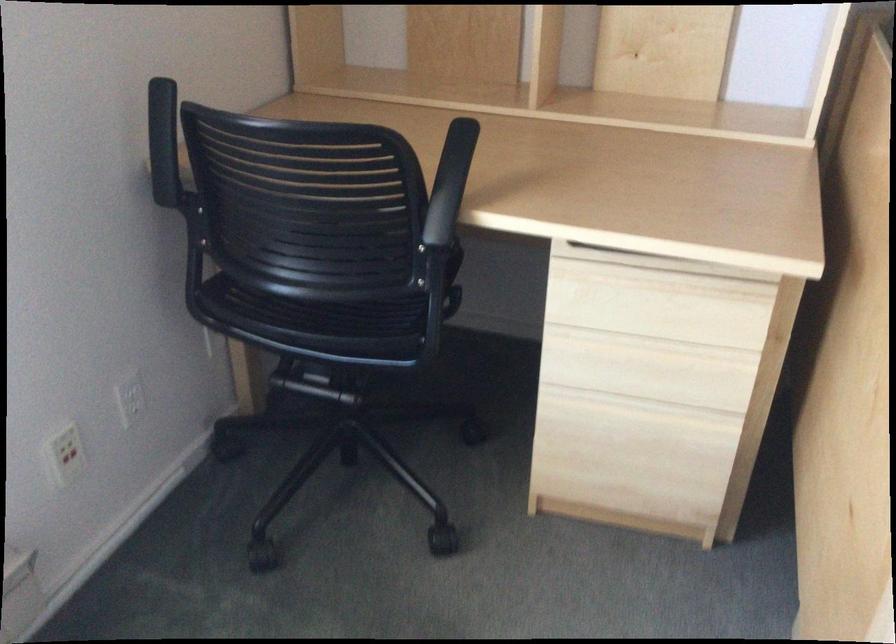
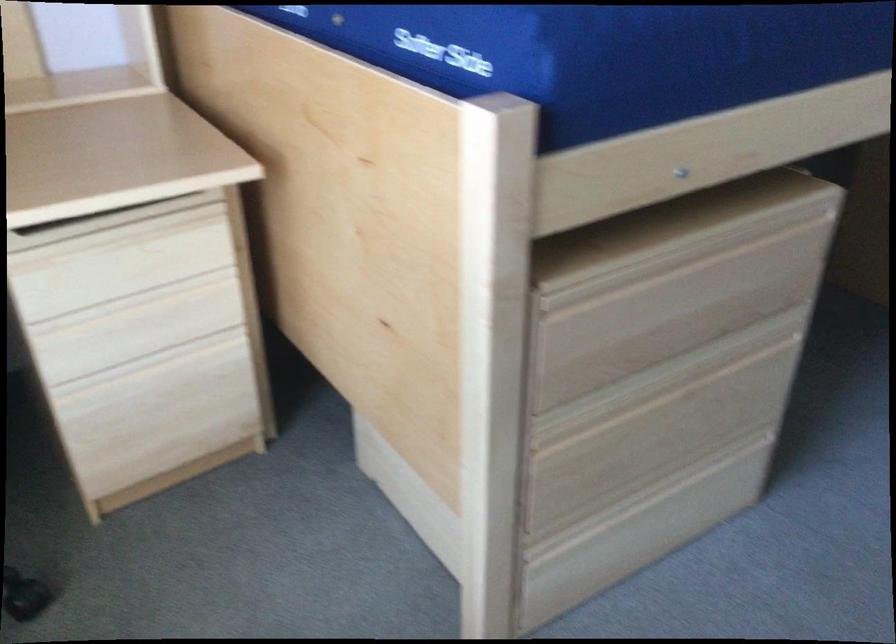
In the second image, find the point that corresponds to point (642, 343) in the first image.

(134, 301)